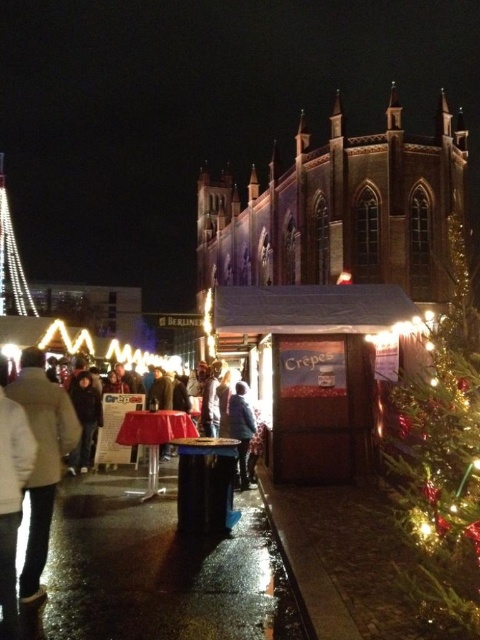
Question: Which object appears farthest from the camera in this image?

Choices:
 (A) green shiny christmas tree at right
 (B) white matte jacket at lower left

Answer: (B)

Question: Which object appears farthest from the camera in this image?

Choices:
 (A) white matte jacket at lower left
 (B) green shiny christmas tree at right

Answer: (A)

Question: Does white matte jacket at lower left appear on the right side of green shiny christmas tree at right?

Choices:
 (A) yes
 (B) no

Answer: (B)

Question: Can you confirm if white matte jacket at lower left is smaller than green shiny christmas tree at right?

Choices:
 (A) yes
 (B) no

Answer: (A)

Question: Can you confirm if white matte jacket at lower left is bigger than green shiny christmas tree at right?

Choices:
 (A) no
 (B) yes

Answer: (A)